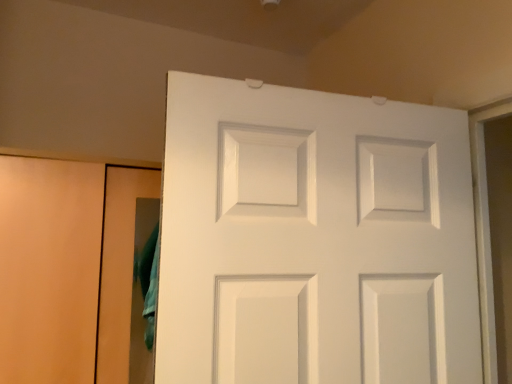
Question: Should I look upward or downward to see white glossy door at center?

Choices:
 (A) up
 (B) down

Answer: (B)